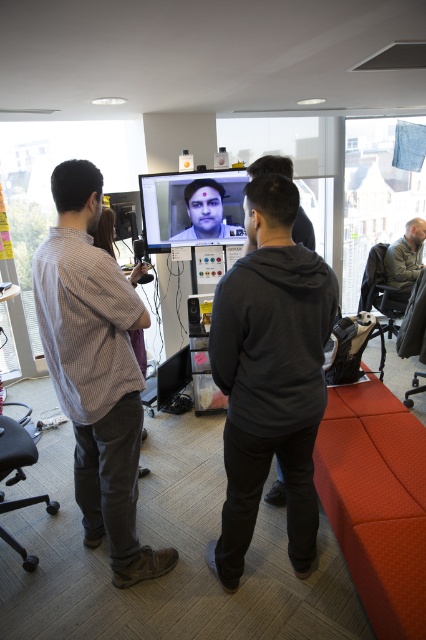
Between point (140, 404) and point (281, 166), which one is positioned behind?

Positioned behind is point (281, 166).

Can you confirm if checkered fabric shirt at left is positioned to the left of matte black shirt at center?

Correct, you'll find checkered fabric shirt at left to the left of matte black shirt at center.

Which is behind, point (66, 208) or point (267, 164)?

Positioned behind is point (267, 164).

This screenshot has width=426, height=640. I want to click on checkered fabric shirt at left, so pos(95,369).

Can you confirm if dark gray hoodie at center is bigger than gray fabric jacket at right?

Indeed, dark gray hoodie at center has a larger size compared to gray fabric jacket at right.

Can you confirm if dark gray hoodie at center is positioned to the left of gray fabric jacket at right?

Indeed, dark gray hoodie at center is positioned on the left side of gray fabric jacket at right.

Describe the element at coordinates (270, 376) in the screenshot. This screenshot has width=426, height=640. I see `dark gray hoodie at center` at that location.

The image size is (426, 640). Identify the location of dark gray hoodie at center. (270, 376).

Does point (11, 544) come farther from viewer compared to point (207, 186)?

That is False.

Does black leather swivel chair at lower left appear over matte black face at center?

A: No, black leather swivel chair at lower left is not above matte black face at center.

Is point (2, 442) behind point (235, 228)?

No.

Find the location of `black leather swivel chair at lower left`. black leather swivel chair at lower left is located at coordinates (14, 449).